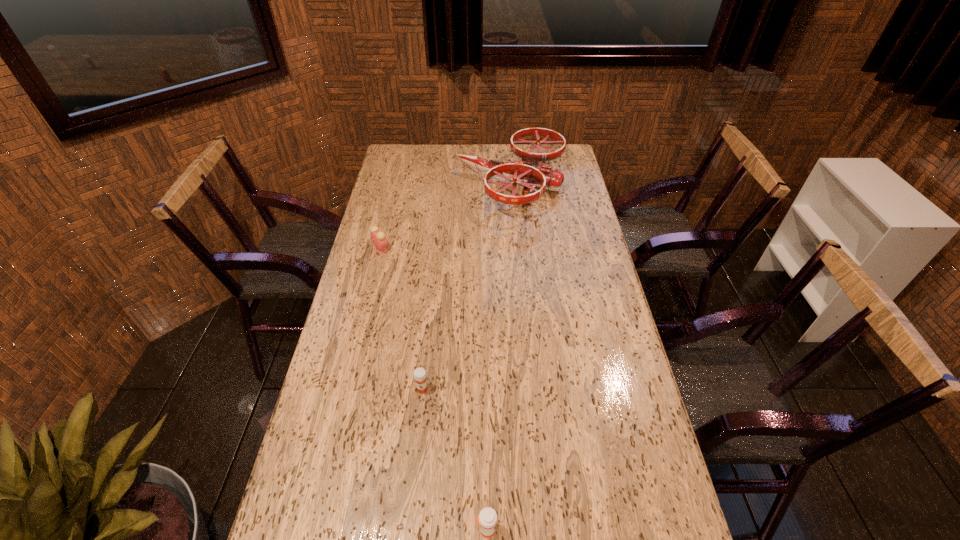
Where is `empty space that is in between the drone and the right medicine`? The width and height of the screenshot is (960, 540). empty space that is in between the drone and the right medicine is located at coordinates (499, 357).

Image resolution: width=960 pixels, height=540 pixels. I want to click on vacant area between the leftmost object and the farthest object, so click(x=446, y=217).

Where is `free point between the second nearest object and the third nearest object`? free point between the second nearest object and the third nearest object is located at coordinates (401, 319).

What are the coordinates of `free space that is in between the farther medicine and the drone` in the screenshot? It's located at (468, 287).

I want to click on vacant space that's between the right medicine and the farthest object, so click(499, 357).

Where is `vacant area that lies between the third nearest object and the farthest object`? This screenshot has width=960, height=540. vacant area that lies between the third nearest object and the farthest object is located at coordinates (446, 217).

Find the location of a particular element. The image size is (960, 540). vacant area that lies between the nearest object and the tallest object is located at coordinates (499, 357).

Find the location of a particular element. The image size is (960, 540). empty location between the second object from left to right and the alarm clock is located at coordinates (401, 319).

This screenshot has width=960, height=540. In order to click on unoccupied position between the nearer medicine and the left medicine in this screenshot , I will do `click(454, 459)`.

The image size is (960, 540). What are the coordinates of `free space between the left medicine and the drone` in the screenshot? It's located at (468, 287).